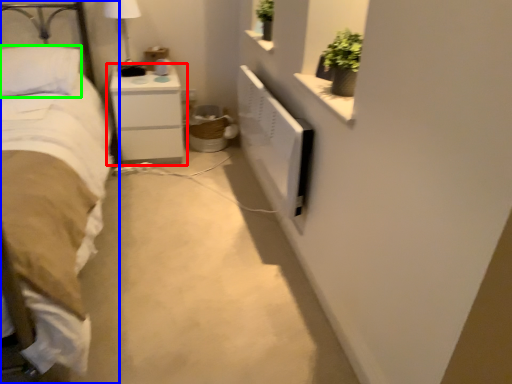
Question: Which object is positioned closest to nightstand (highlighted by a red box)? Select from bed (highlighted by a blue box) and pillow (highlighted by a green box).

Choices:
 (A) bed
 (B) pillow

Answer: (B)